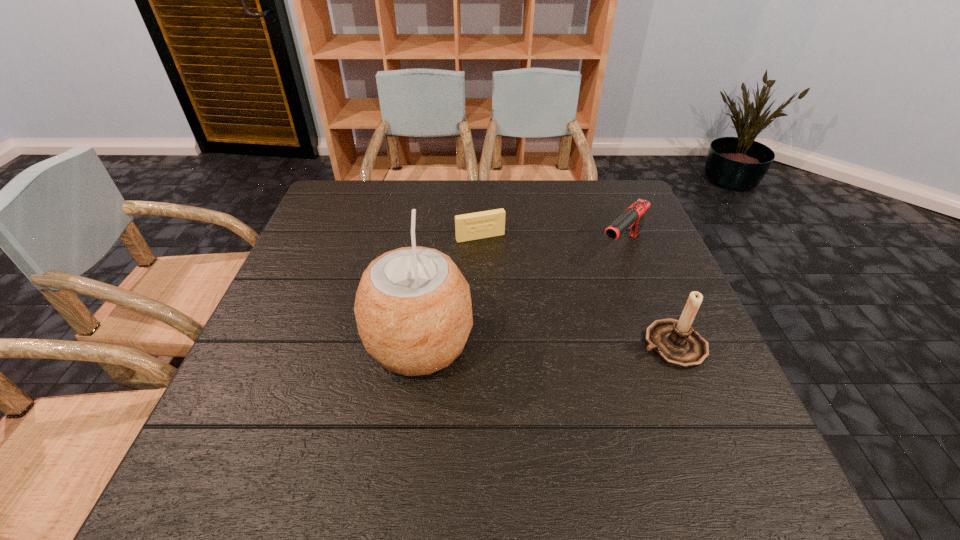
Locate an element on the screen. This screenshot has height=540, width=960. free space on the desktop that is between the tallest object and the candle holder and is positioned at the front of the videotape with spools is located at coordinates (530, 343).

Locate an element on the screen. This screenshot has width=960, height=540. vacant spot on the desktop that is between the tallest object and the second tallest object and is positioned at the aiming end of the gun is located at coordinates (526, 343).